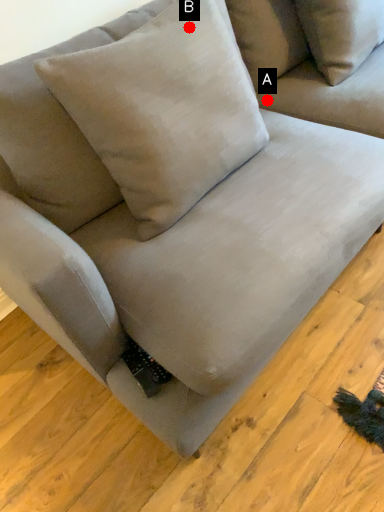
Question: Two points are circled on the image, labeled by A and B beside each circle. Which point is closer to the camera?

Choices:
 (A) A is closer
 (B) B is closer

Answer: (B)